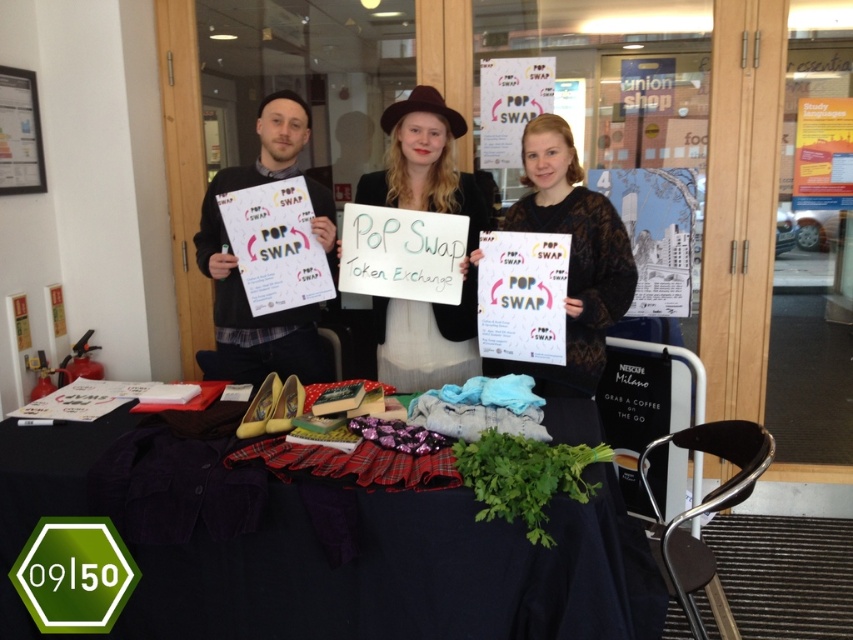
In the scene shown: You are standing in front of the Pop Swap event table. There is a point at coordinates point (630, 632) on the table. If you want to place a small item there, will it be visible to someone standing behind the table?

The point (630, 632) is 1.53 meters away from the viewer, so placing a small item there would make it visible to someone standing behind the table as well.